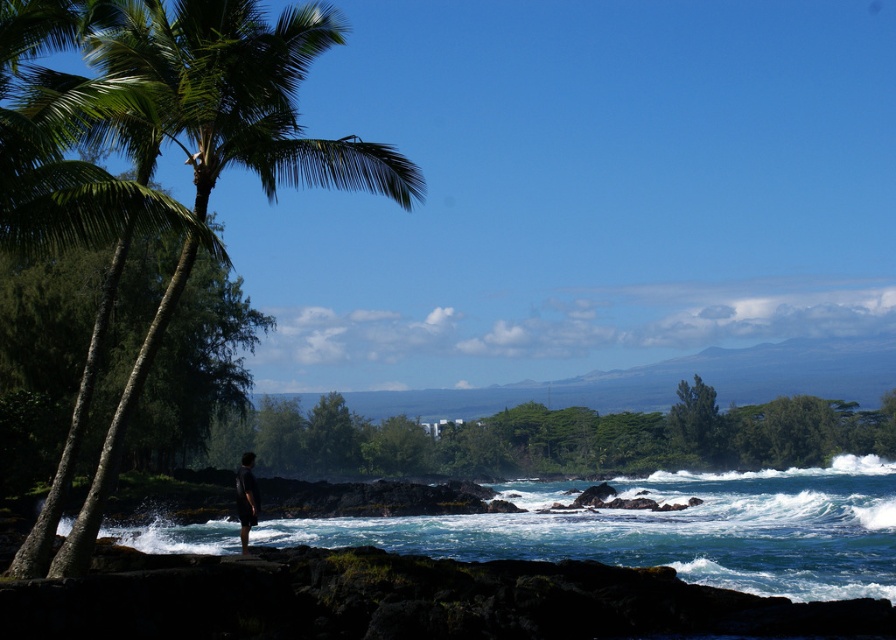
You are a hiker who wants to take a photo of the dark gray shorts at center while standing near the green leafy palm tree at left. Since you need to frame both objects in your camera, will the palm tree block the view of the shorts?

The green leafy palm tree at left is taller than dark gray shorts at center, so the palm tree might block the view of the shorts depending on the angle and distance. To frame both, you might need to position yourself where the palm tree is partially visible in the background while the shorts are in the foreground, ensuring they are not obscured.

You are standing at the edge of the rocky shore looking out at the ocean. There are two points marked in the scene. Which point, point (179, 138) or point (253, 492), is closer to you?

Point (179, 138) is closer to the camera than point (253, 492), so it is closer to you.